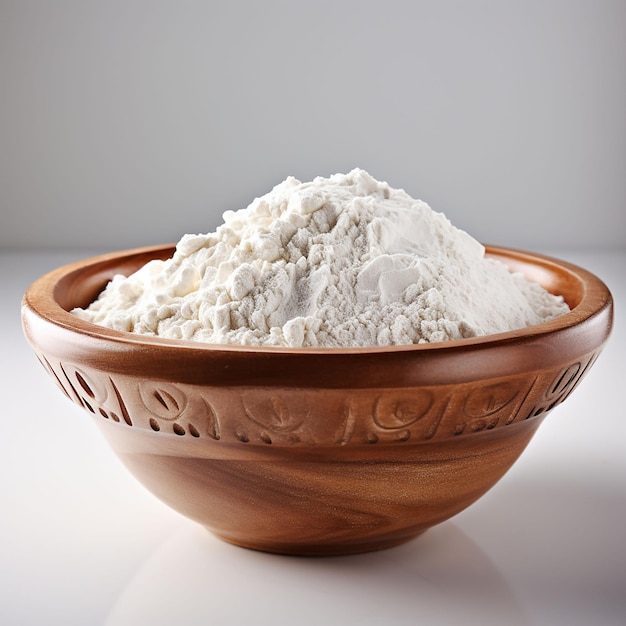
Image resolution: width=626 pixels, height=626 pixels. In order to click on bowl in this screenshot , I will do `click(198, 393)`.